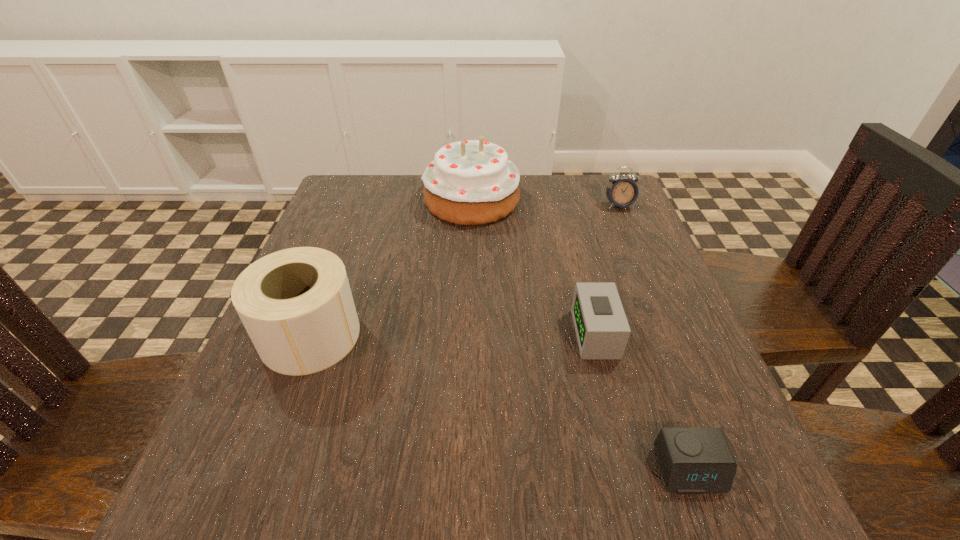
At what (x,y) coordinates should I click in order to perform the action: click on cake. Please return your answer as a coordinate pair (x, y). Looking at the image, I should click on (473, 182).

Where is `the second object from left to right`? This screenshot has width=960, height=540. the second object from left to right is located at coordinates (473, 182).

The height and width of the screenshot is (540, 960). Identify the location of toilet tissue. [x=296, y=305].

Where is `the second tallest object`? Image resolution: width=960 pixels, height=540 pixels. the second tallest object is located at coordinates (296, 305).

Where is `the tallest alarm clock`? the tallest alarm clock is located at coordinates (623, 192).

This screenshot has width=960, height=540. Find the location of `the third shortest object`. the third shortest object is located at coordinates (623, 192).

Locate an element on the screen. The height and width of the screenshot is (540, 960). the fourth tallest object is located at coordinates (602, 330).

Locate an element on the screen. The width and height of the screenshot is (960, 540). the third object from left to right is located at coordinates (602, 330).

The image size is (960, 540). Find the location of `the shortest object`. the shortest object is located at coordinates (693, 460).

What are the coordinates of `the shortest alarm clock` in the screenshot? It's located at (693, 460).